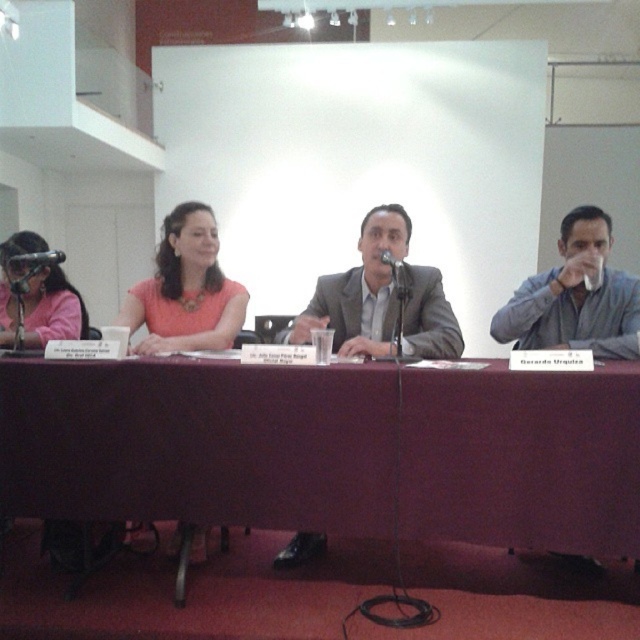
Question: Among these points, which one is farthest from the camera?

Choices:
 (A) (420, 412)
 (B) (28, 340)
 (C) (636, 330)
 (D) (147, 278)

Answer: (D)

Question: Which point is farther from the camera taking this photo?

Choices:
 (A) (540, 344)
 (B) (385, 260)
 (C) (72, 323)
 (D) (51, 500)

Answer: (C)

Question: Does matte gray shirt at right have a lesser width compared to black matte microphone at center?

Choices:
 (A) yes
 (B) no

Answer: (B)

Question: Does matte gray suit at center appear over matte pink shirt at left?

Choices:
 (A) no
 (B) yes

Answer: (A)

Question: Which point is closer to the camera?

Choices:
 (A) black matte microphone at center
 (B) matte gray shirt at right

Answer: (A)

Question: Does maroon fabric table at center appear under black matte microphone at center?

Choices:
 (A) yes
 (B) no

Answer: (A)